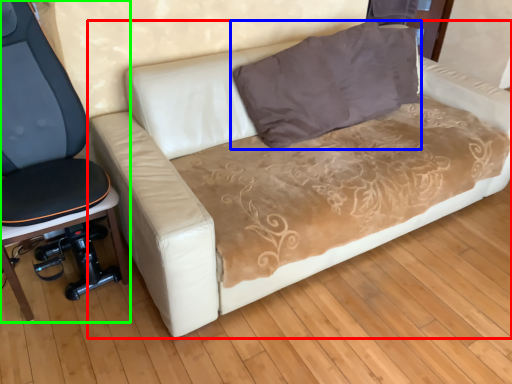
Question: Which object is the farthest from studio couch (highlighted by a red box)? Choose among these: pillow (highlighted by a blue box) or furniture (highlighted by a green box).

Choices:
 (A) pillow
 (B) furniture

Answer: (B)